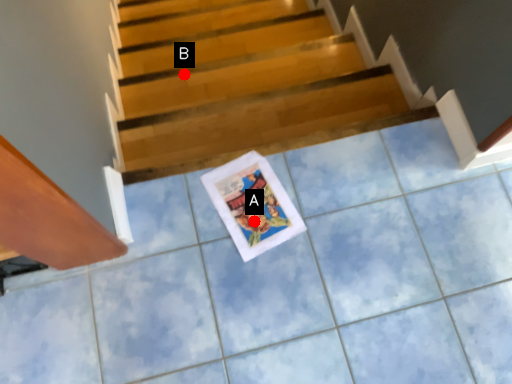
Question: Two points are circled on the image, labeled by A and B beside each circle. Which point is farther to the camera?

Choices:
 (A) A is further
 (B) B is further

Answer: (B)